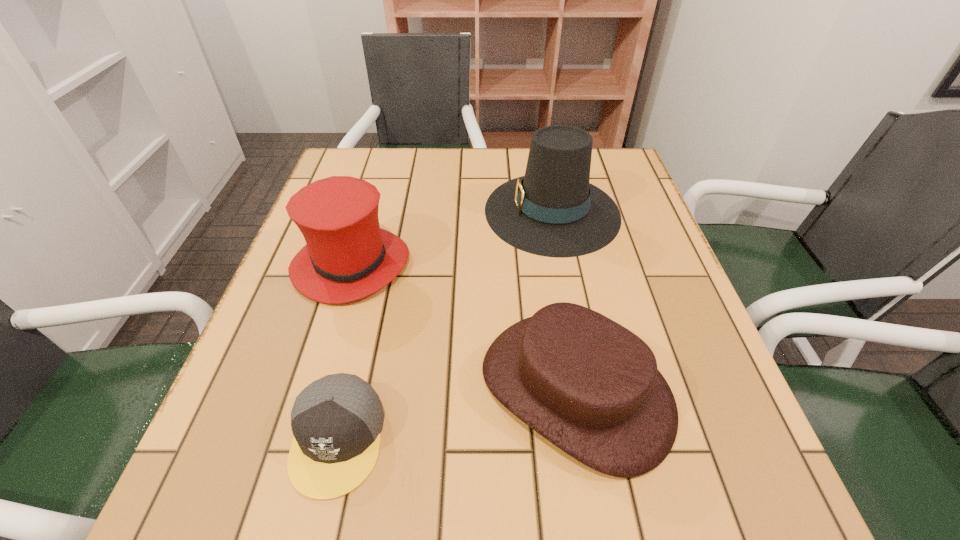
Image resolution: width=960 pixels, height=540 pixels. Find the location of `blank space located 0.310m on the left of the second shortest object`. blank space located 0.310m on the left of the second shortest object is located at coordinates (301, 389).

Identify the location of object located in the far edge section of the desktop. (553, 211).

Identify the location of hat that is at the near edge. (591, 387).

I want to click on cap present at the near edge, so pos(336,421).

In order to click on hat positioned at the left edge in this screenshot , I will do `click(347, 256)`.

Locate an element on the screen. The width and height of the screenshot is (960, 540). cap positioned at the left edge is located at coordinates (336, 421).

Where is `object at the near left corner`? The height and width of the screenshot is (540, 960). object at the near left corner is located at coordinates (336, 421).

Identify the location of object that is at the far right corner. Image resolution: width=960 pixels, height=540 pixels. (553, 211).

Where is `object located in the near right corner section of the desktop`? object located in the near right corner section of the desktop is located at coordinates 591,387.

Image resolution: width=960 pixels, height=540 pixels. In the image, there is a desktop. What are the coordinates of `vacant area at the far edge` in the screenshot? It's located at (445, 181).